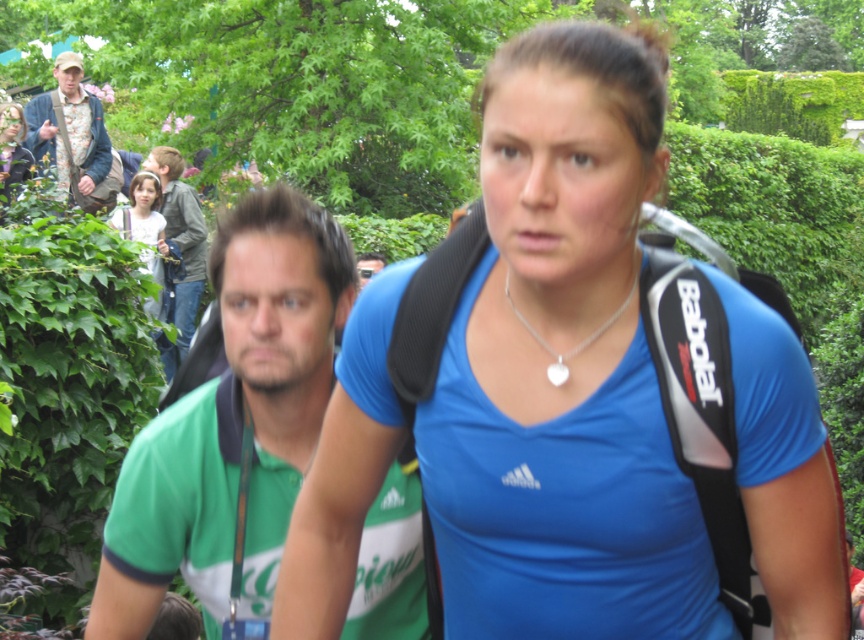
Question: Does blue fabric shirt at center have a lesser width compared to green fabric shirt at center?

Choices:
 (A) no
 (B) yes

Answer: (A)

Question: In this image, where is light brown hair at upper left located relative to silver/smooth heart at center?

Choices:
 (A) below
 (B) above

Answer: (B)

Question: Which point is closer to the camera?

Choices:
 (A) silver/smooth heart at center
 (B) green fabric shirt at upper left

Answer: (A)

Question: Considering the real-world distances, which object is closest to the light brown hair at upper left?

Choices:
 (A) green fabric shirt at upper left
 (B) floral-patterned shirt at upper left

Answer: (A)

Question: Which object appears closest to the camera in this image?

Choices:
 (A) floral-patterned shirt at upper left
 (B) green fabric shirt at upper left
 (C) matte black backpack at upper left

Answer: (B)

Question: Is green fabric shirt at left to the right of floral-patterned shirt at upper left from the viewer's perspective?

Choices:
 (A) no
 (B) yes

Answer: (B)